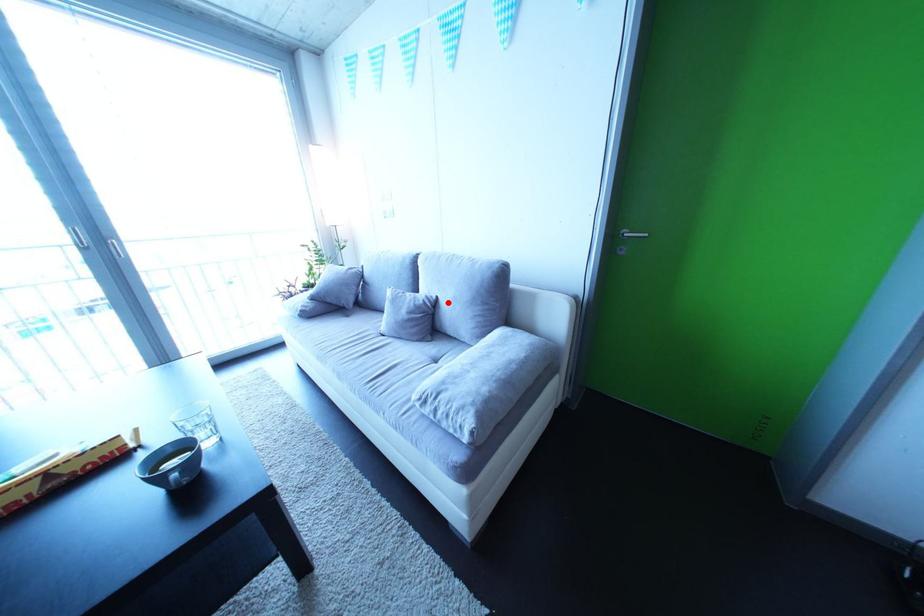
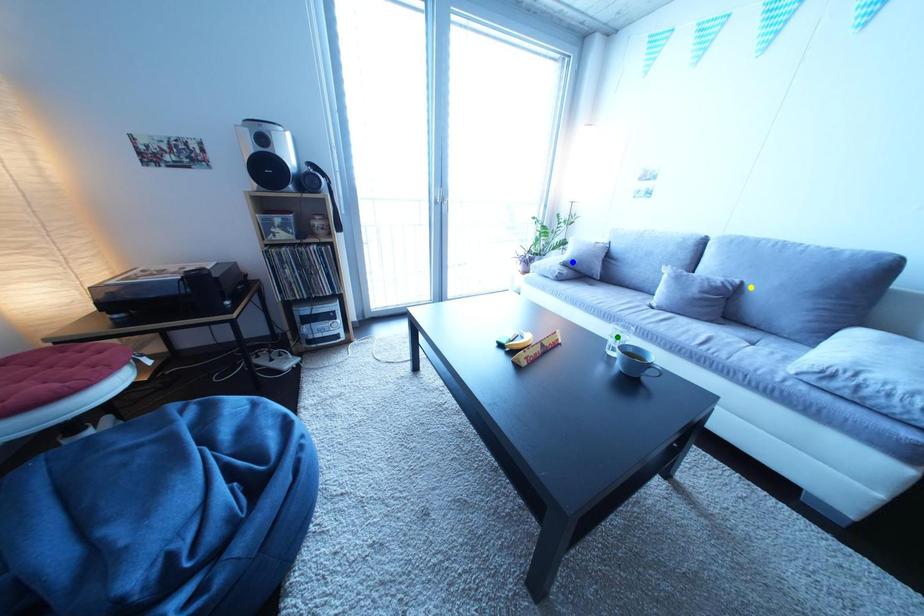
Question: I am providing you with two images of the same scene from different viewpoints. A red point is marked on the first image. You are given multiple points on the second image. Which spot in image 2 lines up with the point in image 1?

Choices:
 (A) yellow point
 (B) green point
 (C) blue point

Answer: (A)